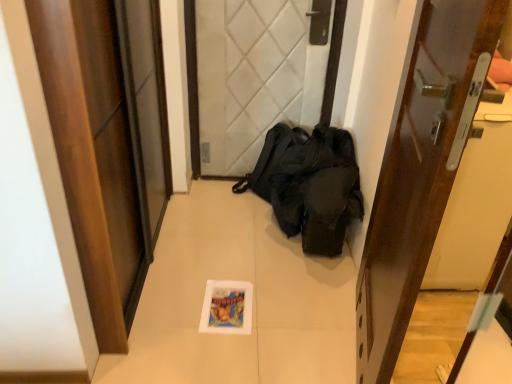
The image size is (512, 384). Identify the location of free spot behind wooden glossy door at right, the 1th door positioned from the right. (298, 269).